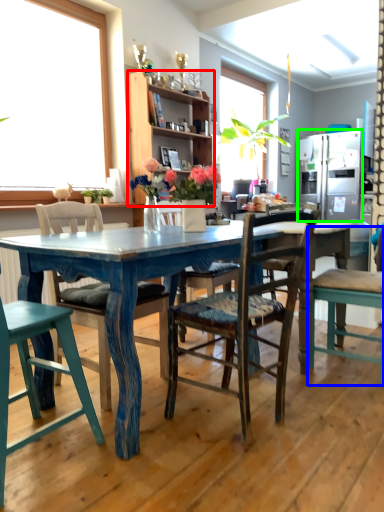
Question: Which object is the farthest from cabinetry (highlighted by a red box)? Choose among these: chair (highlighted by a blue box) or refrigerator (highlighted by a green box).

Choices:
 (A) chair
 (B) refrigerator

Answer: (A)